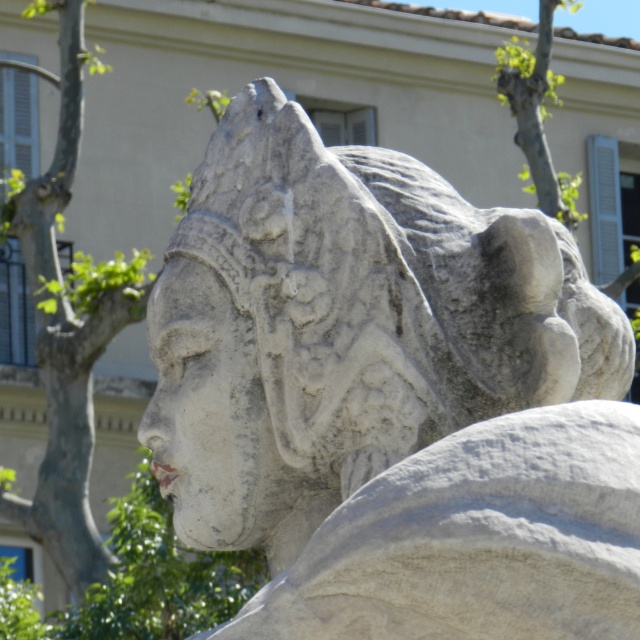
You are standing in front of a stone sculpture and a tree. The white stone head at center is part of the sculpture, and the green leafy tree at left is nearby. From your perspective, which object is closer to you?

The white stone head at center is closer to you because it is in front of the green leafy tree at left, meaning the tree is behind it.

What object is located at the coordinates point (x=294, y=330) in the image?

The white stone head at center is located at point (x=294, y=330).

You are standing in front of a stone sculpture and a tree. The white stone head at center and the green leafy tree at left are both in your view. Which object is positioned to the right of the other?

The white stone head at center is to the right of the green leafy tree at left according to the description.